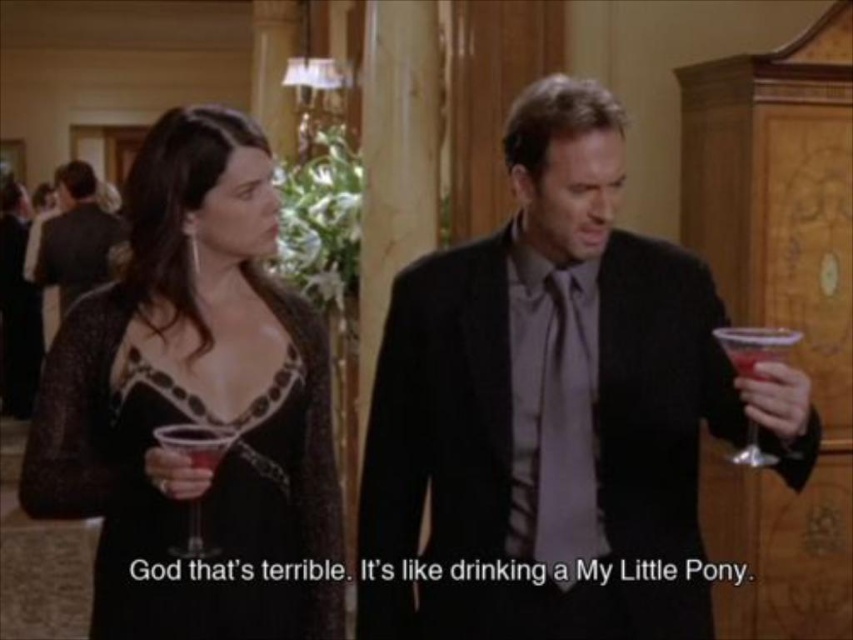
Question: Is black lace dress at center positioned before translucent glass wine glass at center?

Choices:
 (A) yes
 (B) no

Answer: (B)

Question: Which point appears farthest from the camera in this image?

Choices:
 (A) (105, 276)
 (B) (437, 292)
 (C) (757, 449)
 (D) (222, 452)

Answer: (A)

Question: Is shiny black suit at center thinner than translucent glass wine glass at center?

Choices:
 (A) yes
 (B) no

Answer: (B)

Question: Is transparent plastic wine glass at right closer to camera compared to translucent glass wine glass at center?

Choices:
 (A) yes
 (B) no

Answer: (A)

Question: Which of the following is the closest to the observer?

Choices:
 (A) translucent glass wine glass at center
 (B) black lace dress at center
 (C) shiny black suit at center
 (D) transparent plastic wine glass at right

Answer: (D)

Question: Which point is farther to the camera?

Choices:
 (A) matte black suit at center
 (B) transparent plastic wine glass at right
 (C) black lace dress at center

Answer: (A)